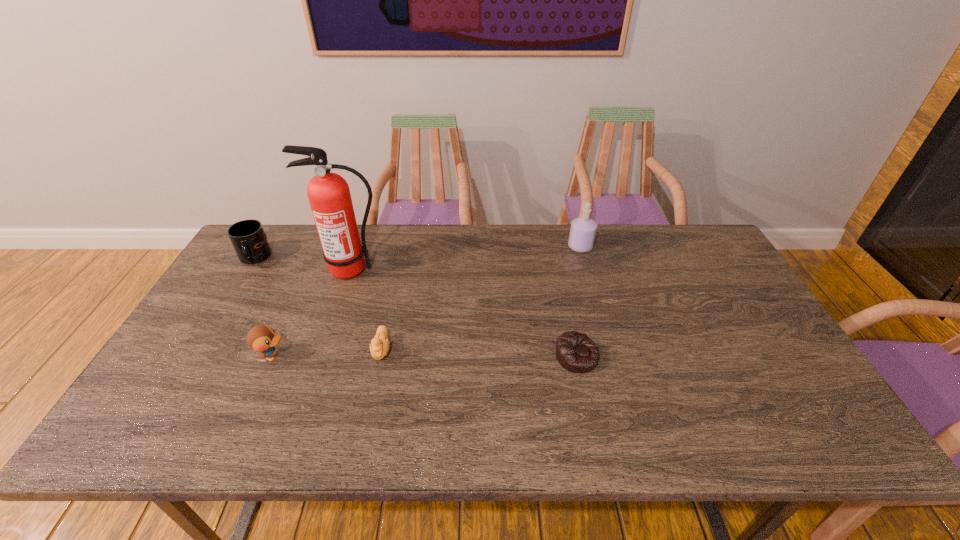
Where is `free spot between the perfume and the beanbag`? The height and width of the screenshot is (540, 960). free spot between the perfume and the beanbag is located at coordinates (579, 301).

What are the coordinates of `vacant space that's between the duck and the duckling` in the screenshot? It's located at (327, 353).

Locate an element on the screen. This screenshot has height=540, width=960. blank region between the mug and the fire extinguisher is located at coordinates (303, 264).

Choose which object is the fifth nearest neighbor to the perfume. Please provide its 2D coordinates. Your answer should be formatted as a tuple, i.e. [(x, y)], where the tuple contains the x and y coordinates of a point satisfying the conditions above.

[(248, 238)]

Find the location of a particular element. The image size is (960, 540). object that is the third nearest to the tallest object is located at coordinates (261, 338).

Find the location of a particular element. This screenshot has height=540, width=960. free spot that satisfies the following two spatial constraints: 1. with the handle on the side of the mug; 2. on the right side of the beanbag is located at coordinates (194, 356).

Identify the location of free spot that satisfies the following two spatial constraints: 1. on the handle side of the fire extinguisher; 2. on the front-facing side of the duck. The image size is (960, 540). (323, 356).

This screenshot has height=540, width=960. I want to click on free space that satisfies the following two spatial constraints: 1. with the handle on the side of the mug; 2. on the right side of the beanbag, so click(194, 356).

Where is `vacant region that satisfies the following two spatial constraints: 1. on the handle side of the beanbag; 2. on the left side of the fire extinguisher`? vacant region that satisfies the following two spatial constraints: 1. on the handle side of the beanbag; 2. on the left side of the fire extinguisher is located at coordinates (323, 356).

At what (x,y) coordinates should I click in order to perform the action: click on free region that satisfies the following two spatial constraints: 1. on the face of the fourth object from left to right; 2. on the front-facing side of the duck. Please return your answer as a coordinate pair (x, y). The height and width of the screenshot is (540, 960). Looking at the image, I should click on (380, 356).